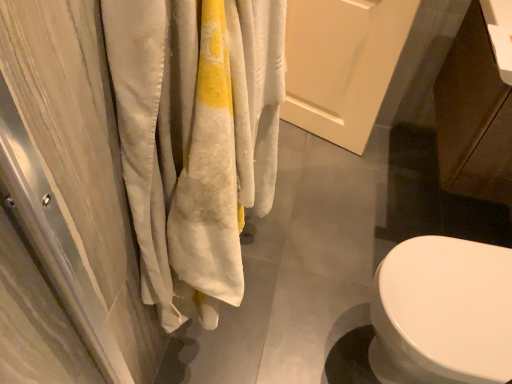
Question: Is white matte door at center situated inside brown matte cabinet at lower right or outside?

Choices:
 (A) inside
 (B) outside

Answer: (B)

Question: From a real-world perspective, is white matte door at center positioned above or below brown matte cabinet at lower right?

Choices:
 (A) below
 (B) above

Answer: (A)

Question: Considering the positions of white matte door at center and brown matte cabinet at lower right in the image, is white matte door at center wider or thinner than brown matte cabinet at lower right?

Choices:
 (A) thin
 (B) wide

Answer: (A)

Question: Is brown matte cabinet at lower right bigger or smaller than white matte door at center?

Choices:
 (A) small
 (B) big

Answer: (B)

Question: Considering the positions of brown matte cabinet at lower right and white matte door at center in the image, is brown matte cabinet at lower right taller or shorter than white matte door at center?

Choices:
 (A) short
 (B) tall

Answer: (A)

Question: In the image, is brown matte cabinet at lower right on the left side or the right side of white matte door at center?

Choices:
 (A) right
 (B) left

Answer: (A)

Question: Is brown matte cabinet at lower right spatially inside white matte door at center, or outside of it?

Choices:
 (A) outside
 (B) inside

Answer: (A)